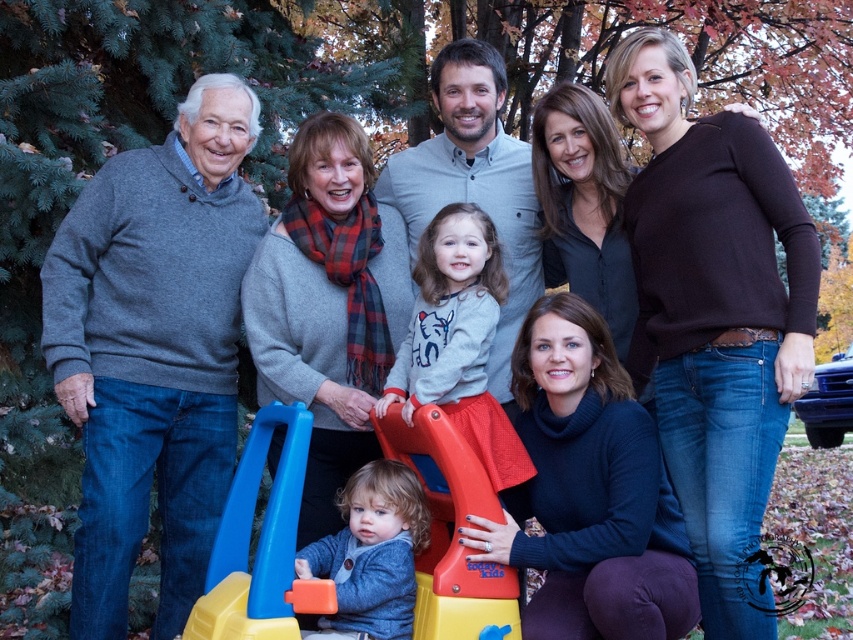
Measure the distance between point (93, 499) and camera.

Point (93, 499) and camera are 4.27 meters apart.

Between point (114, 314) and point (274, 477), which one is positioned in front?

Point (274, 477) is more forward.

Describe the element at coordinates (154, 349) in the screenshot. The height and width of the screenshot is (640, 853). I see `gray sweater at left` at that location.

Locate an element on the screen. gray sweater at left is located at coordinates (154, 349).

Does blue plastic toy at lower left come in front of red plastic slide at lower center?

Yes, blue plastic toy at lower left is closer to the viewer.

Which is more to the left, blue plastic toy at lower left or red plastic slide at lower center?

From the viewer's perspective, blue plastic toy at lower left appears more on the left side.

At what (x,y) coordinates should I click in order to perform the action: click on blue plastic toy at lower left. Please return your answer as a coordinate pair (x, y). The height and width of the screenshot is (640, 853). Looking at the image, I should click on (260, 541).

The height and width of the screenshot is (640, 853). What are the coordinates of `blue plastic toy at lower left` in the screenshot? It's located at (260, 541).

How far apart are blue plastic toy at lower left and soft gray sweater at center?

blue plastic toy at lower left is 18.11 inches away from soft gray sweater at center.

Looking at this image, is blue plastic toy at lower left above soft gray sweater at center?

Yes.

Does point (281, 616) come closer to viewer compared to point (424, 525)?

Yes, it is.

Image resolution: width=853 pixels, height=640 pixels. In order to click on blue plastic toy at lower left in this screenshot , I will do `click(260, 541)`.